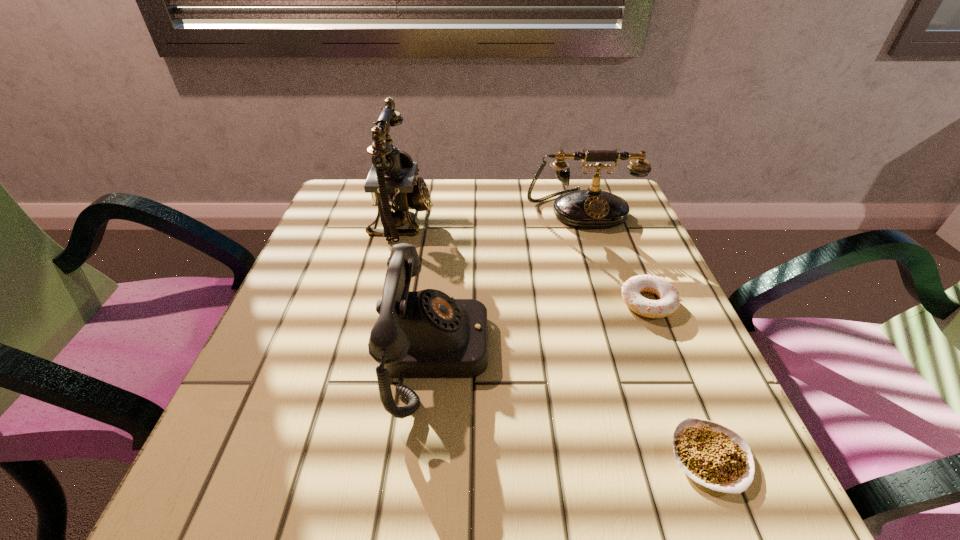
Locate an element on the screen. free space that is in between the nearest telephone and the fourth tallest object is located at coordinates (541, 327).

This screenshot has width=960, height=540. Identify the location of vacant space in between the doughnut and the rightmost telephone. (614, 255).

Where is `empty space between the shortest object and the tallest telephone`? empty space between the shortest object and the tallest telephone is located at coordinates (556, 339).

At what (x,y) coordinates should I click in order to perform the action: click on free space between the nearest telephone and the legume. Please return your answer as a coordinate pair (x, y). The image size is (960, 540). Looking at the image, I should click on (573, 405).

Locate which object is the fourth closest to the second shortest object. Please provide its 2D coordinates. Your answer should be formatted as a tuple, i.e. [(x, y)], where the tuple contains the x and y coordinates of a point satisfying the conditions above.

[(392, 182)]

Locate an element on the screen. This screenshot has height=540, width=960. object identified as the third closest to the second shortest object is located at coordinates (420, 334).

Choose which telephone is the third nearest neighbor to the second shortest object. Please provide its 2D coordinates. Your answer should be formatted as a tuple, i.e. [(x, y)], where the tuple contains the x and y coordinates of a point satisfying the conditions above.

[(392, 182)]

Identify which telephone is the second nearest to the rightmost telephone. Please provide its 2D coordinates. Your answer should be formatted as a tuple, i.e. [(x, y)], where the tuple contains the x and y coordinates of a point satisfying the conditions above.

[(420, 334)]

Where is `vacant space that satisfies the following two spatial constraints: 1. on the rotary dial of the tallest telephone; 2. on the left side of the doughnut`? The height and width of the screenshot is (540, 960). vacant space that satisfies the following two spatial constraints: 1. on the rotary dial of the tallest telephone; 2. on the left side of the doughnut is located at coordinates (x=382, y=302).

Locate an element on the screen. vacant area in the image that satisfies the following two spatial constraints: 1. on the dial of the rightmost telephone; 2. on the left side of the shortest object is located at coordinates [660, 457].